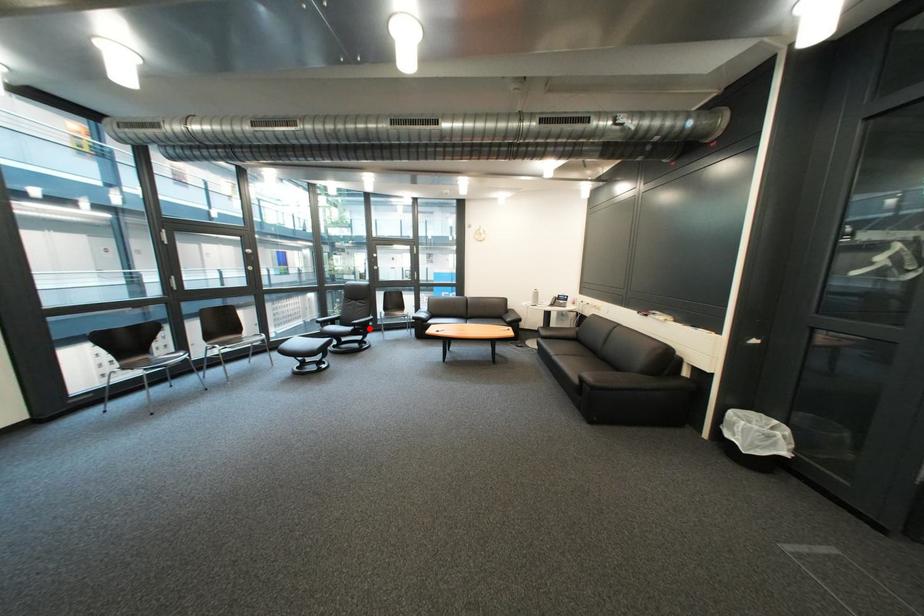
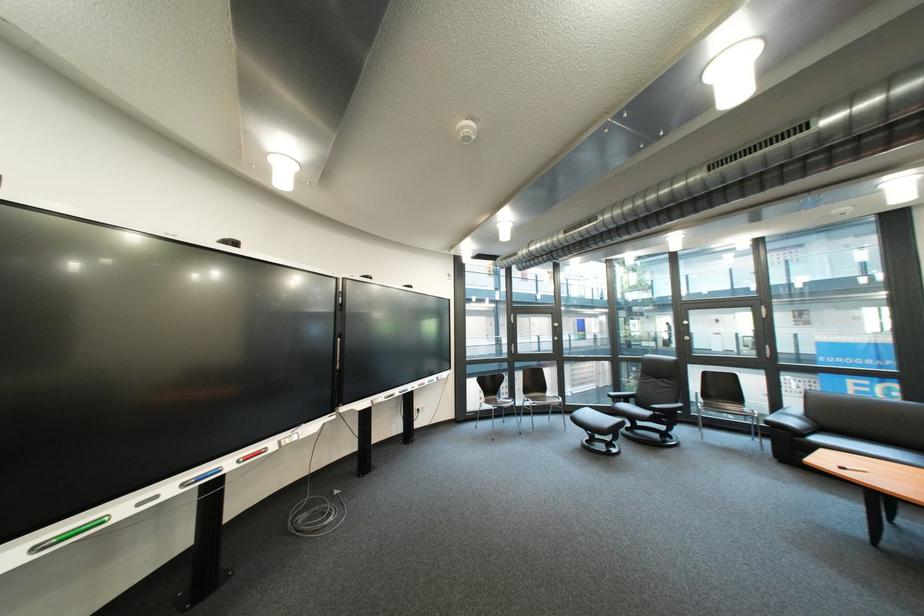
Locate, in the second image, the point that corresponds to the highlighted location in the first image.

(670, 415)